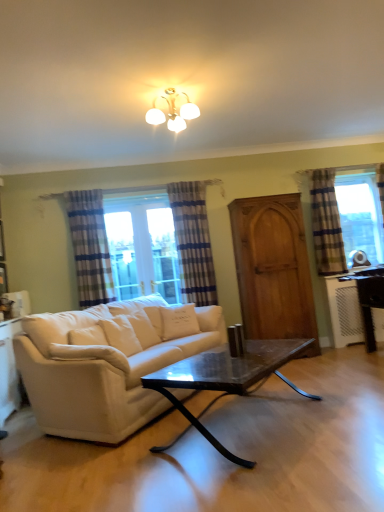
You are a GUI agent. You are given a task and a screenshot of the screen. Output one action in this format:
    pyautogui.click(x=<x>, y=<y>)
    Task: Click on the free point above white glossy light fixture at upper center (from a real-world perspective)
    The height and width of the screenshot is (512, 384).
    Given the screenshot: What is the action you would take?
    pyautogui.click(x=168, y=92)